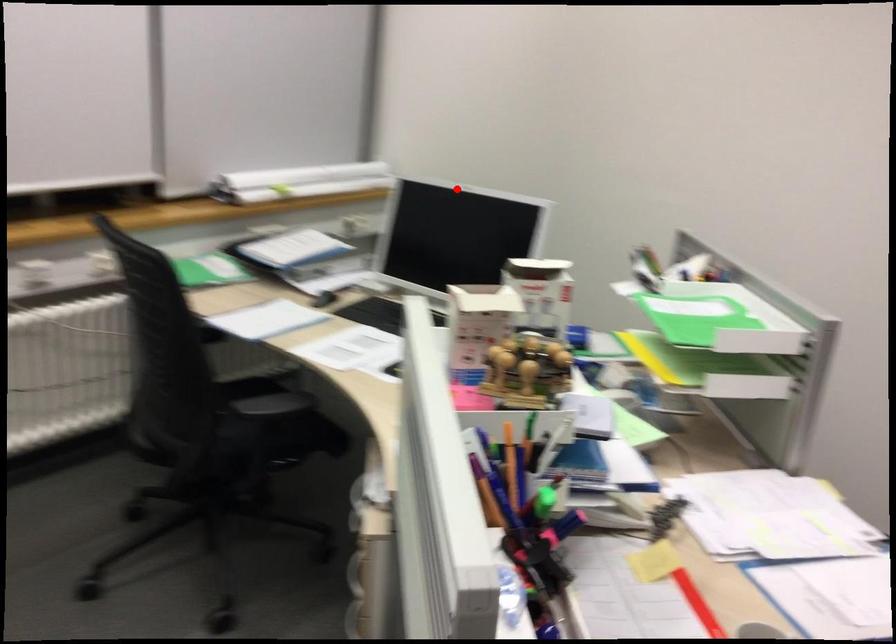
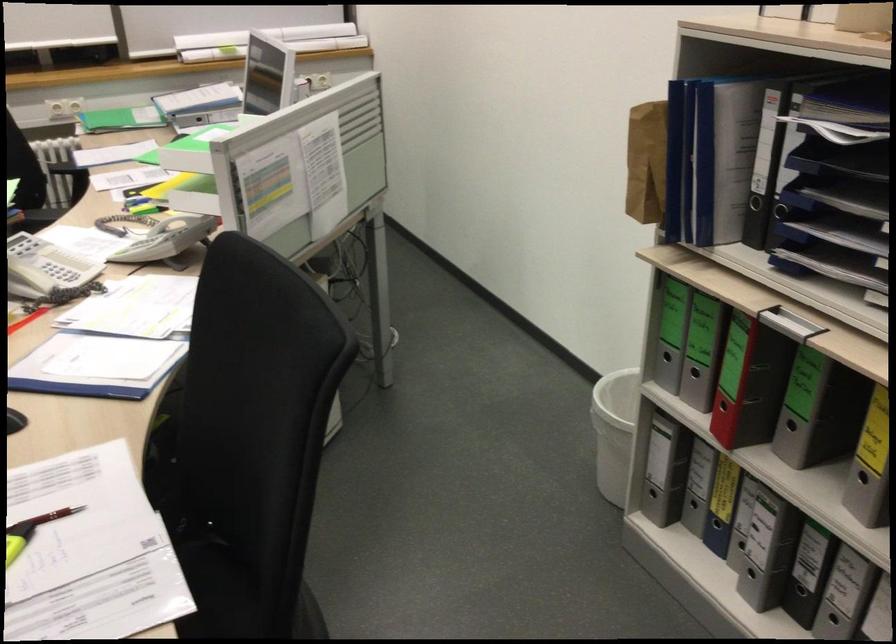
Locate, in the second image, the point that corresponds to the highlighted location in the first image.

(268, 41)